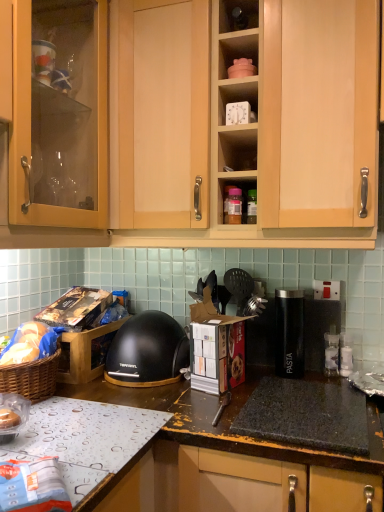
Measure the distance between matte plastic container at upper center, the first shelf positioned from the top, and camera.

They are 1.20 meters apart.

You are a GUI agent. You are given a task and a screenshot of the screen. Output one action in this format:
    pyautogui.click(x=<x>, y=<y>)
    Task: Click on the matte plastic container at upper center, the first shelf positioned from the top
    This screenshot has width=384, height=512.
    Given the screenshot: What is the action you would take?
    pyautogui.click(x=238, y=15)

In order to face metallic silver tray at lower left, should I rotate leftwards or rightwards?

To align with it, rotate left about 16.335°.

Identify the location of black plastic pasta container at center. This screenshot has width=384, height=512. (289, 333).

The image size is (384, 512). What do you see at coordinates (147, 351) in the screenshot?
I see `black matte helmet at center` at bounding box center [147, 351].

What do you see at coordinates (175, 230) in the screenshot? I see `light wood cabinet at upper center` at bounding box center [175, 230].

Where is `matte plastic container at upper center, which appears as the 2th shelf when ordered from the bottom`? matte plastic container at upper center, which appears as the 2th shelf when ordered from the bottom is located at coordinates (238, 15).

Find the location of a particular element. kitchen appliance behind the light wood cabinet at upper center is located at coordinates (289, 333).

From a real-world perspective, does black plastic pasta container at center sit lower than light wood cabinet at upper center?

Yes, from a real-world perspective, black plastic pasta container at center is under light wood cabinet at upper center.

Consider the image. Is black plastic pasta container at center oriented away from light wood cabinet at upper center?

black plastic pasta container at center is not turned away from light wood cabinet at upper center.

Which object is closer to the camera taking this photo, black plastic pasta container at center or light wood cabinet at upper center?

Positioned in front is light wood cabinet at upper center.

From the picture: Is metallic silver tray at lower left oriented away from clear plastic bag at lower left?

No, metallic silver tray at lower left is not facing away from clear plastic bag at lower left.

Are metallic silver tray at lower left and clear plastic bag at lower left located far from each other?

No, metallic silver tray at lower left is in close proximity to clear plastic bag at lower left.

Considering the relative positions of metallic silver tray at lower left and clear plastic bag at lower left in the image provided, is metallic silver tray at lower left to the right of clear plastic bag at lower left from the viewer's perspective?

Indeed, metallic silver tray at lower left is positioned on the right side of clear plastic bag at lower left.

Considering the relative sizes of metallic silver tray at lower left and clear plastic bag at lower left in the image provided, is metallic silver tray at lower left thinner than clear plastic bag at lower left?

In fact, metallic silver tray at lower left might be wider than clear plastic bag at lower left.

Who is taller, black matte helmet at center or black plastic pasta container at center?

black plastic pasta container at center.

Considering the points (156, 345) and (276, 342), which point is behind, point (156, 345) or point (276, 342)?

Positioned behind is point (276, 342).

Is black matte helmet at center far away from black plastic pasta container at center?

They are positioned close to each other.

Find the location of a particular element. countertop below the light wood cabinet at upper center (from the image's perspective) is located at coordinates (84, 440).

Can you confirm if light wood cabinet at upper center is smaller than metallic silver tray at lower left?

Actually, light wood cabinet at upper center might be larger than metallic silver tray at lower left.

From the image's perspective, is light wood cabinet at upper center on top of metallic silver tray at lower left?

Yes, from the image's perspective, light wood cabinet at upper center is on top of metallic silver tray at lower left.

Between black plastic pasta container at center and white plastic clock at upper center, the first shelf in the bottom-to-top sequence, which one appears on the right side from the viewer's perspective?

black plastic pasta container at center is more to the right.

How many degrees apart are the facing directions of black plastic pasta container at center and white plastic clock at upper center, the first shelf in the bottom-to-top sequence?

The angle between the facing direction of black plastic pasta container at center and the facing direction of white plastic clock at upper center, the first shelf in the bottom-to-top sequence, is 7.22 degrees.

Measure the distance between black plastic pasta container at center and white plastic clock at upper center, the 2th shelf from the top.

A distance of 27.32 inches exists between black plastic pasta container at center and white plastic clock at upper center, the 2th shelf from the top.

Where is `kitchen appliance that appears behind the white plastic clock at upper center, the 2th shelf from the top`? The height and width of the screenshot is (512, 384). kitchen appliance that appears behind the white plastic clock at upper center, the 2th shelf from the top is located at coordinates (289, 333).

From the image's perspective, is white plastic clock at upper center, the first shelf in the bottom-to-top sequence, positioned above or below black granite gas stove at lower center?

Clearly, from the image's perspective, white plastic clock at upper center, the first shelf in the bottom-to-top sequence, is above black granite gas stove at lower center.

Find the location of a particular element. This screenshot has height=512, width=384. gas stove below the white plastic clock at upper center, the 2th shelf from the top (from the image's perspective) is located at coordinates (306, 415).

From a real-world perspective, relative to black granite gas stove at lower center, is white plastic clock at upper center, the 2th shelf from the top, vertically above or below?

white plastic clock at upper center, the 2th shelf from the top, is above black granite gas stove at lower center.

What's the angular difference between black plastic pasta container at center and metallic silver tray at lower left's facing directions?

The angle between the facing direction of black plastic pasta container at center and the facing direction of metallic silver tray at lower left is 97.2 degrees.

Considering the sizes of objects black plastic pasta container at center and metallic silver tray at lower left in the image provided, who is shorter, black plastic pasta container at center or metallic silver tray at lower left?

metallic silver tray at lower left is shorter.

Considering the relative positions of black plastic pasta container at center and metallic silver tray at lower left in the image provided, is black plastic pasta container at center behind metallic silver tray at lower left?

Yes, black plastic pasta container at center is further from the viewer.

Is there a large distance between black plastic pasta container at center and metallic silver tray at lower left?

No, black plastic pasta container at center is in close proximity to metallic silver tray at lower left.

Where is `kitchen appliance on the right of light wood cabinet at upper center`? The height and width of the screenshot is (512, 384). kitchen appliance on the right of light wood cabinet at upper center is located at coordinates (289, 333).

The image size is (384, 512). I want to click on countertop that appears below the clear plastic bag at lower left (from a real-world perspective), so click(x=84, y=440).

From the image, which object appears to be farther from metallic silver tray at lower left, matte plastic container at upper center, which appears as the 2th shelf when ordered from the bottom, or black granite gas stove at lower center?

matte plastic container at upper center, which appears as the 2th shelf when ordered from the bottom, is positioned further to the anchor metallic silver tray at lower left.

Considering their positions, is matte plastic container at upper center, which appears as the 2th shelf when ordered from the bottom, positioned closer to black plastic pasta container at center than clear plastic bag at lower left?

clear plastic bag at lower left is closer to black plastic pasta container at center.

When comparing their distances from light wood cabinet at upper center, does black matte helmet at center or matte plastic container at upper center, the first shelf positioned from the top, seem further?

matte plastic container at upper center, the first shelf positioned from the top, is positioned further to the anchor light wood cabinet at upper center.

Considering their positions, is clear plastic bag at lower left positioned closer to black plastic pasta container at center than black matte helmet at center?

The object closer to black plastic pasta container at center is black matte helmet at center.

When comparing their distances from metallic silver tray at lower left, does light wood cabinet at upper center or black matte helmet at center seem closer?

black matte helmet at center lies closer to metallic silver tray at lower left than the other object.

Considering their positions, is white plastic clock at upper center, the 2th shelf from the top, positioned closer to matte plastic container at upper center, the first shelf positioned from the top, than metallic silver tray at lower left?

Among the two, white plastic clock at upper center, the 2th shelf from the top, is located nearer to matte plastic container at upper center, the first shelf positioned from the top.

Based on their spatial positions, is clear plastic bag at lower left or light wood cabinet at upper center closer to matte plastic container at upper center, the first shelf positioned from the top?

Among the two, light wood cabinet at upper center is located nearer to matte plastic container at upper center, the first shelf positioned from the top.

Looking at this image, considering their positions, is clear plastic bag at lower left positioned closer to black granite gas stove at lower center than black matte helmet at center?

black matte helmet at center is positioned closer to the anchor black granite gas stove at lower center.

Identify the location of gas stove situated between clear plastic bag at lower left and black plastic pasta container at center from left to right. point(306,415).

Locate an element on the screen. This screenshot has width=384, height=512. kitchen appliance between light wood cabinet at upper center and metallic silver tray at lower left vertically is located at coordinates (289, 333).

Where is `shelf that lies between matte plastic container at upper center, which appears as the 2th shelf when ordered from the bottom, and clear plastic bag at lower left from top to bottom`? The image size is (384, 512). shelf that lies between matte plastic container at upper center, which appears as the 2th shelf when ordered from the bottom, and clear plastic bag at lower left from top to bottom is located at coordinates (236, 97).

You are a GUI agent. You are given a task and a screenshot of the screen. Output one action in this format:
    pyautogui.click(x=<x>, y=<y>)
    Task: Click on the cabinetry between clear plastic bag at lower left and black plastic pasta container at center from left to right
    The image size is (384, 512).
    Given the screenshot: What is the action you would take?
    pyautogui.click(x=175, y=230)